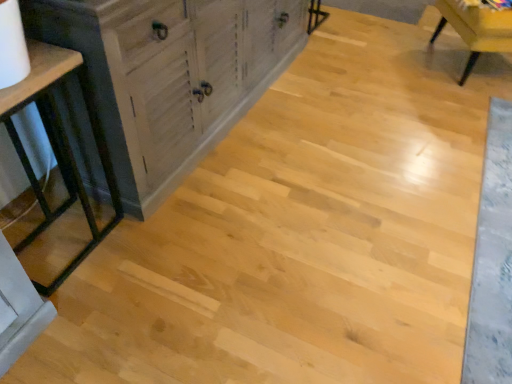
Where is `free space that is in between distressed wood cabinet at left and matte black table at left`? free space that is in between distressed wood cabinet at left and matte black table at left is located at coordinates (89, 239).